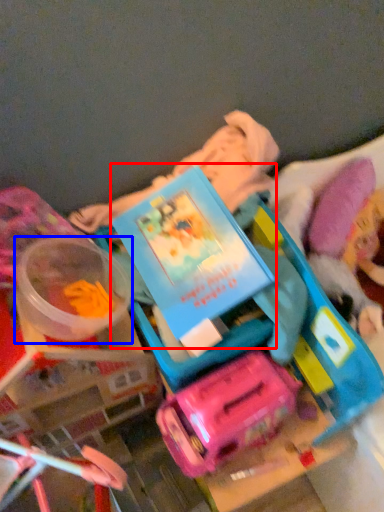
Question: Which of the following is the farthest to the observer, book (highlighted by a red box) or toy (highlighted by a blue box)?

Choices:
 (A) book
 (B) toy

Answer: (B)